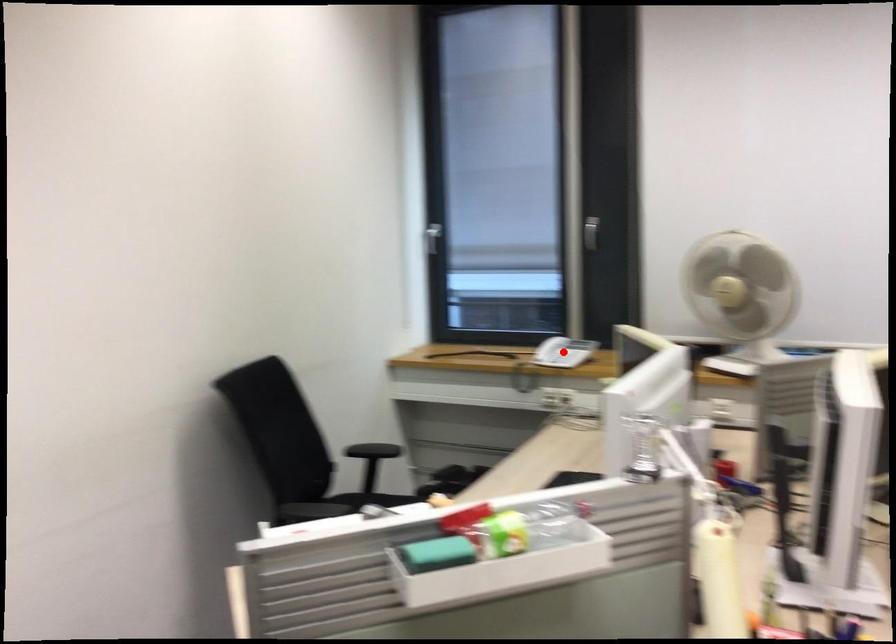
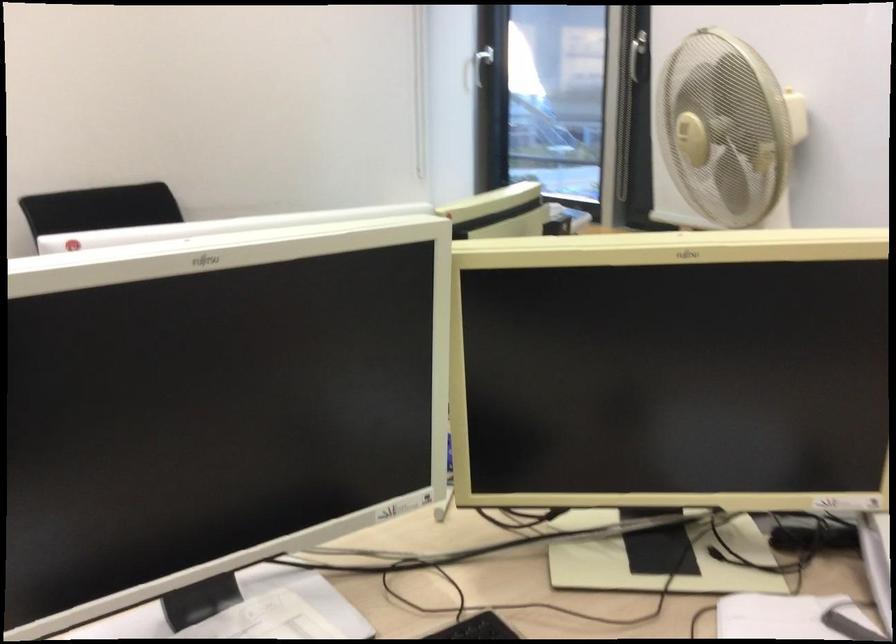
Question: I am providing you with two images of the same scene from different viewpoints. A red point is marked on the first image. At the location where the point appears in image 1, is it still visible in image 2?

Choices:
 (A) Yes
 (B) No

Answer: (B)